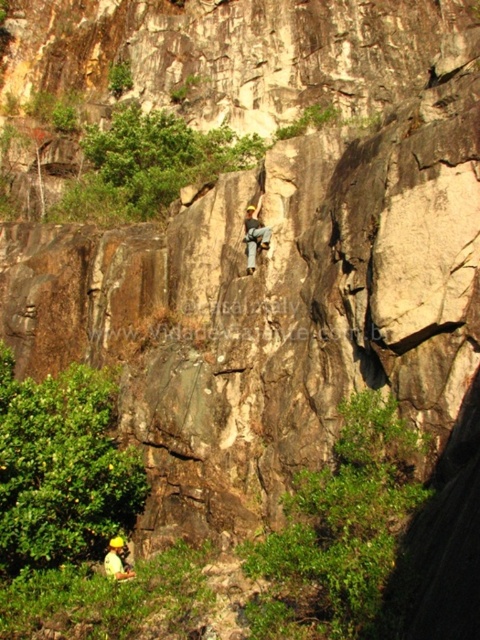
Question: Is light brown leather harness at center further to the viewer compared to yellow helmeted climber at center?

Choices:
 (A) no
 (B) yes

Answer: (B)

Question: Which point is closer to the camera?

Choices:
 (A) light brown leather harness at center
 (B) yellow helmeted climber at center

Answer: (B)

Question: Does light brown leather harness at center come in front of yellow helmeted climber at center?

Choices:
 (A) no
 (B) yes

Answer: (A)

Question: Which point is closer to the camera taking this photo?

Choices:
 (A) (248, 228)
 (B) (109, 577)

Answer: (B)

Question: Which point appears farthest from the camera in this image?

Choices:
 (A) (113, 554)
 (B) (254, 208)

Answer: (B)

Question: Can you confirm if light brown leather harness at center is wider than yellow helmeted climber at center?

Choices:
 (A) yes
 (B) no

Answer: (B)